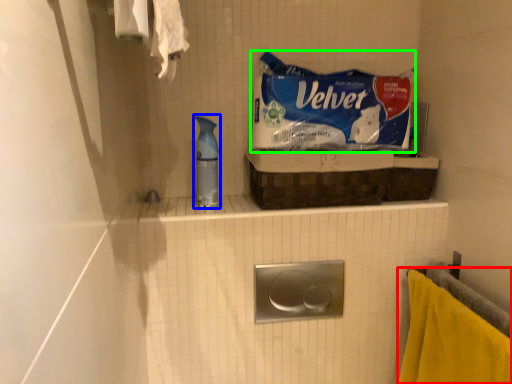
Question: Considering the real-world distances, which object is farthest from towel (highlighted by a red box)? cleaning product (highlighted by a blue box) or product (highlighted by a green box)?

Choices:
 (A) cleaning product
 (B) product

Answer: (A)